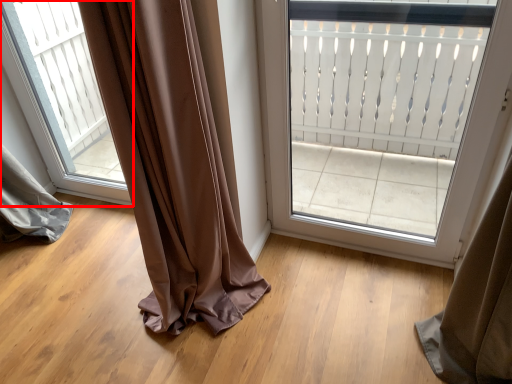
Question: From the image's perspective, what is the correct spatial relationship of window (annotated by the red box) in relation to door?

Choices:
 (A) above
 (B) below

Answer: (A)